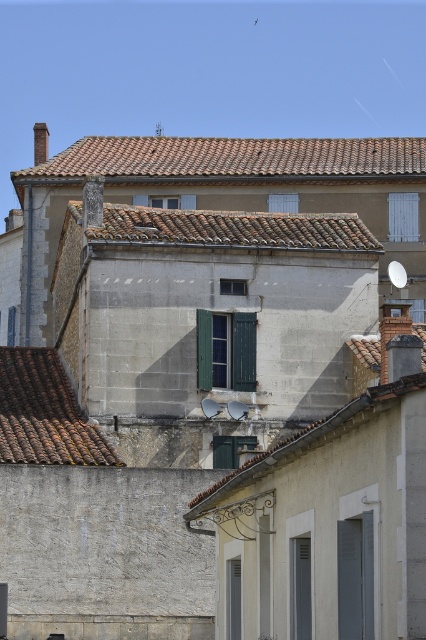
Question: Can you confirm if brown tile roof at center is thinner than brown tile roof at lower left?

Choices:
 (A) yes
 (B) no

Answer: (B)

Question: Which object is closer to the camera taking this photo?

Choices:
 (A) white wood shutter at upper center
 (B) brown tile roof at lower left

Answer: (B)

Question: Which point is closer to the camera?

Choices:
 (A) (88, 461)
 (B) (255, 380)
 (C) (417, 212)
 (D) (290, 198)

Answer: (A)

Question: Which of the following is the closest to the observer?

Choices:
 (A) (397, 211)
 (B) (357, 528)
 (C) (158, 212)
 (D) (331, 154)

Answer: (B)

Question: Does brown tile roof at upper center appear on the left side of green matte shutter at center?

Choices:
 (A) yes
 (B) no

Answer: (A)

Question: Does green matte shutters at center appear on the left side of white wood shutter at upper center?

Choices:
 (A) no
 (B) yes

Answer: (B)